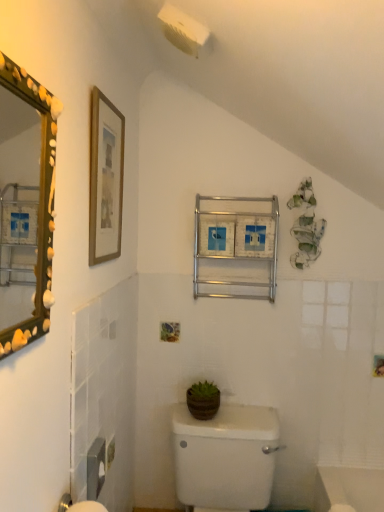
Where is `free spot to the right of green matte pot at center`? free spot to the right of green matte pot at center is located at coordinates (248, 412).